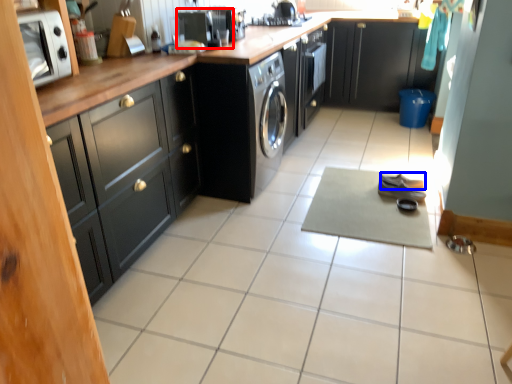
Question: Which point is closer to the camera, appliance (highlighted by a red box) or shoe (highlighted by a blue box)?

Choices:
 (A) appliance
 (B) shoe

Answer: (A)